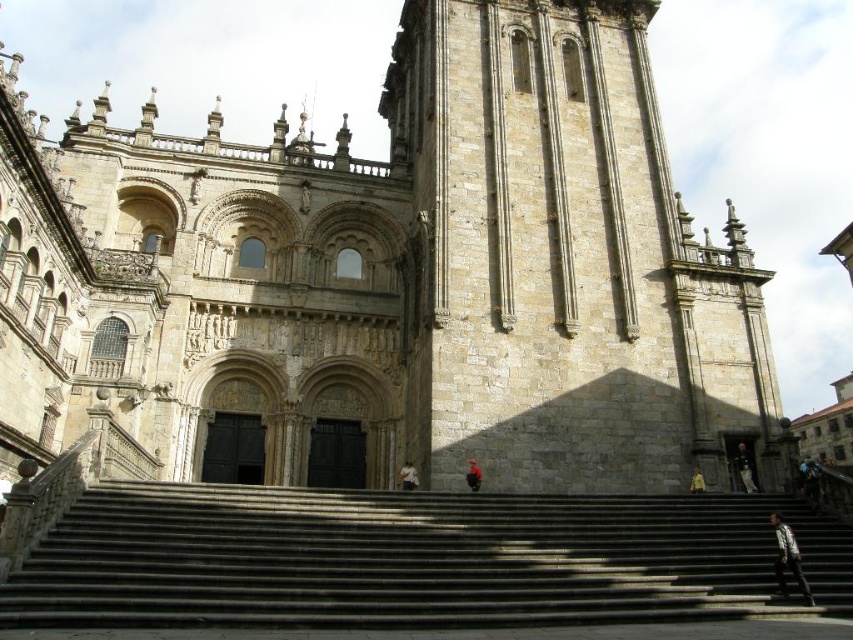
Is dark gray fabric jacket at lower right further to the viewer compared to red fabric person at center?

No.

Between dark gray fabric jacket at lower right and red fabric person at center, which one is positioned higher?

red fabric person at center is higher up.

Who is more forward, (796, 563) or (480, 470)?

Point (796, 563)

Where is `dark gray fabric jacket at lower right`? The width and height of the screenshot is (853, 640). dark gray fabric jacket at lower right is located at coordinates (788, 557).

Can you confirm if dark blue jeans at lower right is smaller than light brown leather jacket at right?

Yes, dark blue jeans at lower right is smaller than light brown leather jacket at right.

Which is in front, point (753, 486) or point (692, 490)?

Point (692, 490) is in front.

Locate an element on the screen. The image size is (853, 640). dark blue jeans at lower right is located at coordinates pos(746,468).

Does blue fabric jacket at lower right have a smaller size compared to dark blue jeans at lower right?

No.

Identify the location of blue fabric jacket at lower right. (809, 477).

The width and height of the screenshot is (853, 640). I want to click on blue fabric jacket at lower right, so click(x=809, y=477).